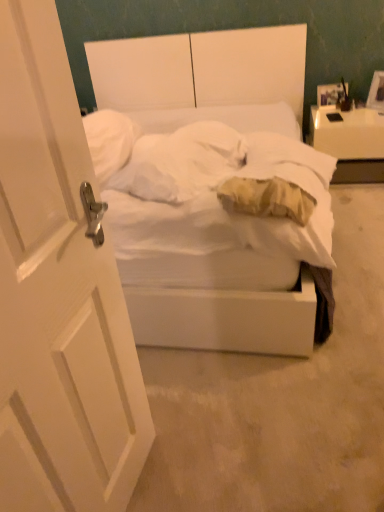
Question: Considering the relative sizes of wooden photo frame at upper right and white matte door at left in the image provided, is wooden photo frame at upper right smaller than white matte door at left?

Choices:
 (A) yes
 (B) no

Answer: (A)

Question: Is wooden photo frame at upper right bigger than white matte door at left?

Choices:
 (A) no
 (B) yes

Answer: (A)

Question: Is white matte door at left located within wooden photo frame at upper right?

Choices:
 (A) yes
 (B) no

Answer: (B)

Question: Does wooden photo frame at upper right have a lesser width compared to white matte door at left?

Choices:
 (A) yes
 (B) no

Answer: (A)

Question: From a real-world perspective, is wooden photo frame at upper right physically below white matte door at left?

Choices:
 (A) no
 (B) yes

Answer: (B)

Question: Is wooden photo frame at upper right completely or partially outside of white matte door at left?

Choices:
 (A) yes
 (B) no

Answer: (A)

Question: Is white matte door at left not near soft yellow pillow at center?

Choices:
 (A) no
 (B) yes

Answer: (A)

Question: Is white matte door at left outside of soft yellow pillow at center?

Choices:
 (A) yes
 (B) no

Answer: (A)

Question: Does white matte door at left contain soft yellow pillow at center?

Choices:
 (A) yes
 (B) no

Answer: (B)

Question: Can you confirm if white matte door at left is wider than soft yellow pillow at center?

Choices:
 (A) no
 (B) yes

Answer: (A)

Question: Considering the relative sizes of white matte door at left and soft yellow pillow at center in the image provided, is white matte door at left shorter than soft yellow pillow at center?

Choices:
 (A) no
 (B) yes

Answer: (A)

Question: Can you confirm if white matte door at left is bigger than soft yellow pillow at center?

Choices:
 (A) yes
 (B) no

Answer: (A)

Question: Considering the relative sizes of white matte bed at center and white glossy nightstand at upper right in the image provided, is white matte bed at center taller than white glossy nightstand at upper right?

Choices:
 (A) no
 (B) yes

Answer: (B)